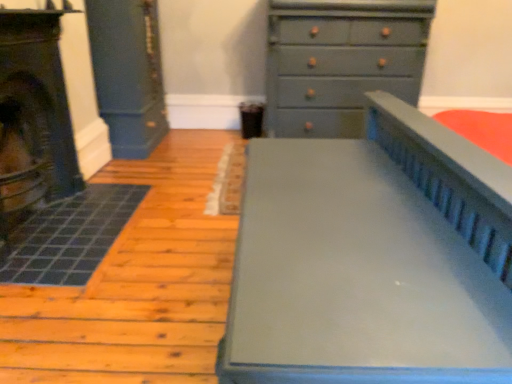
Question: Can you confirm if matte gray chest of drawers at upper right is taller than matte gray bed at center?

Choices:
 (A) yes
 (B) no

Answer: (A)

Question: From the image's perspective, would you say matte gray chest of drawers at upper right is positioned over matte gray bed at center?

Choices:
 (A) yes
 (B) no

Answer: (A)

Question: Is matte gray bed at center surrounded by matte gray chest of drawers at upper right?

Choices:
 (A) yes
 (B) no

Answer: (B)

Question: Does matte gray chest of drawers at upper right come in front of matte gray bed at center?

Choices:
 (A) no
 (B) yes

Answer: (A)

Question: Does matte gray chest of drawers at upper right have a smaller size compared to matte gray bed at center?

Choices:
 (A) no
 (B) yes

Answer: (A)

Question: Is point (472, 334) positioned closer to the camera than point (20, 165)?

Choices:
 (A) closer
 (B) farther

Answer: (A)

Question: From their relative heights in the image, would you say matte gray bed at center is taller or shorter than matte black fireplace at left?

Choices:
 (A) short
 (B) tall

Answer: (A)

Question: From the image's perspective, is matte gray bed at center positioned above or below matte black fireplace at left?

Choices:
 (A) below
 (B) above

Answer: (A)

Question: Considering their positions, is matte gray bed at center located in front of or behind matte black fireplace at left?

Choices:
 (A) front
 (B) behind

Answer: (A)

Question: Considering their positions, is matte gray bed at center located in front of or behind matte gray chest of drawers at upper right?

Choices:
 (A) behind
 (B) front

Answer: (B)

Question: Is matte gray bed at center bigger or smaller than matte gray chest of drawers at upper right?

Choices:
 (A) big
 (B) small

Answer: (B)

Question: Does point (422, 193) appear closer or farther from the camera than point (373, 54)?

Choices:
 (A) closer
 (B) farther

Answer: (A)

Question: From a real-world perspective, is matte gray bed at center physically located above or below matte gray chest of drawers at upper right?

Choices:
 (A) below
 (B) above

Answer: (A)

Question: In terms of width, does matte black fireplace at left look wider or thinner when compared to matte gray chest of drawers at upper right?

Choices:
 (A) wide
 (B) thin

Answer: (B)

Question: Is matte black fireplace at left taller or shorter than matte gray chest of drawers at upper right?

Choices:
 (A) short
 (B) tall

Answer: (A)